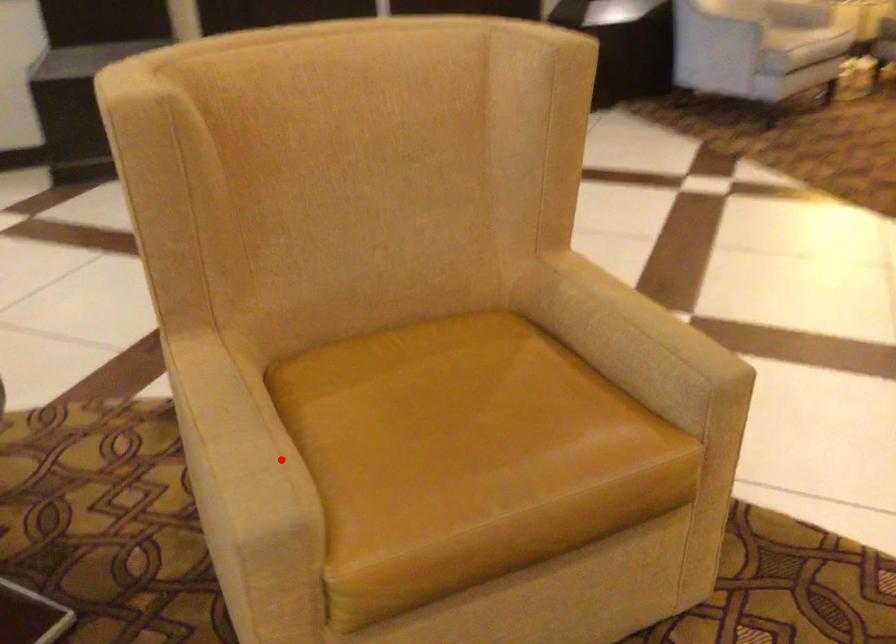
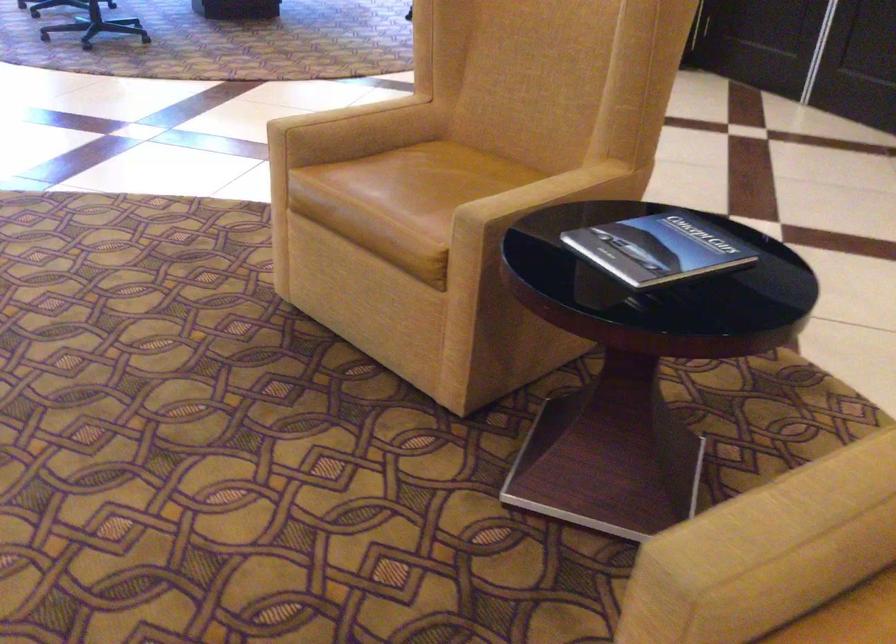
Question: I am providing you with two images of the same scene from different viewpoints. Given a red point in image1, look at the same physical point in image2. Is it:

Choices:
 (A) Closer to the viewpoint
 (B) Farther from the viewpoint

Answer: (A)